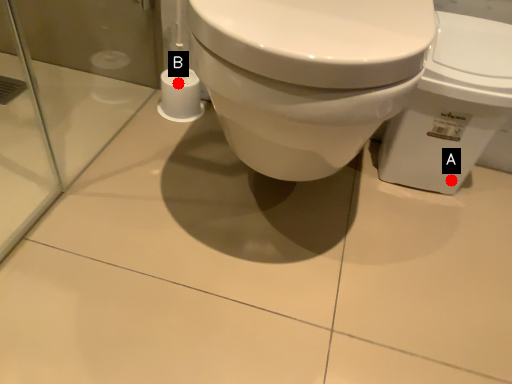
Question: Two points are circled on the image, labeled by A and B beside each circle. Which point appears closest to the camera in this image?

Choices:
 (A) A is closer
 (B) B is closer

Answer: (A)